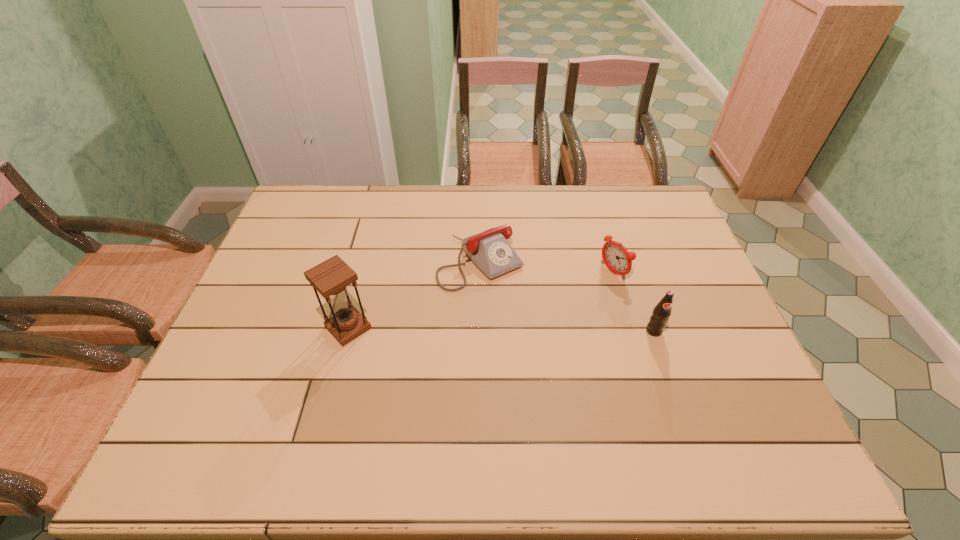
The image size is (960, 540). I want to click on vacant space at the far right corner of the desktop, so click(633, 227).

The width and height of the screenshot is (960, 540). I want to click on vacant area that lies between the shortest object and the hourglass, so click(415, 294).

I want to click on empty space between the pop and the third tallest object, so click(x=634, y=301).

The width and height of the screenshot is (960, 540). What are the coordinates of `free point between the third tallest object and the hourglass` in the screenshot? It's located at (480, 300).

This screenshot has width=960, height=540. Find the location of `empty space between the second object from right to left and the third shortest object`. empty space between the second object from right to left and the third shortest object is located at coordinates (634, 301).

Find the location of a particular element. vacant point located between the hourglass and the rightmost object is located at coordinates (501, 329).

Image resolution: width=960 pixels, height=540 pixels. What are the coordinates of `vacant space in between the third tallest object and the third object from right to left` in the screenshot? It's located at (546, 267).

Find the location of `free space that is in between the third shortest object and the telephone`. free space that is in between the third shortest object and the telephone is located at coordinates (567, 296).

The image size is (960, 540). Find the location of `vacant area between the second shortest object and the rightmost object`. vacant area between the second shortest object and the rightmost object is located at coordinates (634, 301).

You are a GUI agent. You are given a task and a screenshot of the screen. Output one action in this format:
    pyautogui.click(x=<x>, y=<y>)
    Task: Click on the free space between the hourglass and the shortest object
    
    Given the screenshot: What is the action you would take?
    pyautogui.click(x=415, y=294)